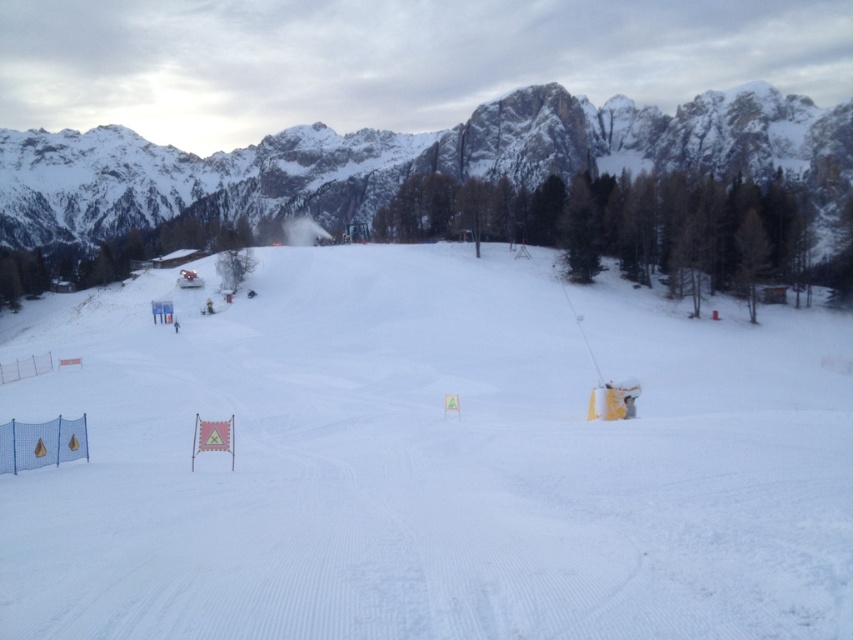
Question: Can you confirm if white powdery snow at center is thinner than snowy granite mountain at upper center?

Choices:
 (A) yes
 (B) no

Answer: (A)

Question: In this image, where is white powdery snow at center located relative to snowy granite mountain at upper center?

Choices:
 (A) left
 (B) right

Answer: (B)

Question: Among these points, which one is nearest to the camera?

Choices:
 (A) (616, 445)
 (B) (221, 204)

Answer: (A)

Question: Is white powdery snow at center positioned at the back of snowy granite mountain at upper center?

Choices:
 (A) no
 (B) yes

Answer: (A)